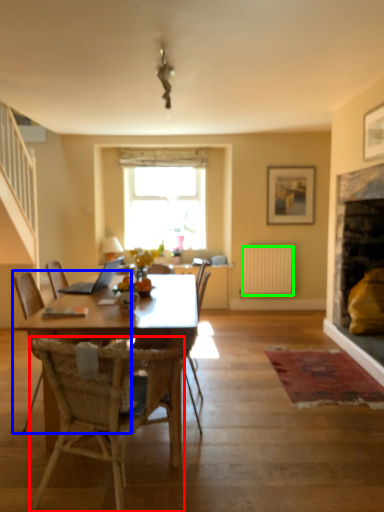
Question: Estimate the real-world distances between objects in this image. Which object is farther from chair (highlighted by a red box), chair (highlighted by a blue box) or radiator (highlighted by a green box)?

Choices:
 (A) chair
 (B) radiator

Answer: (B)